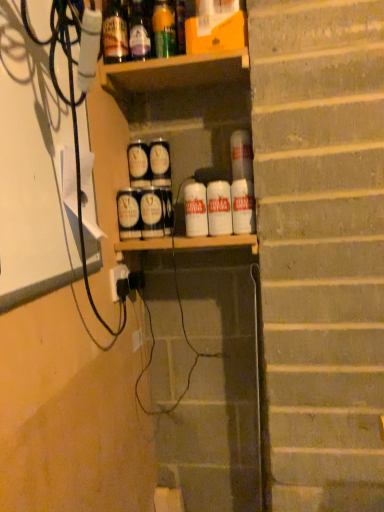
Question: Considering the relative sizes of green glass bottle at upper center, which ranks as the 1th bottle in right-to-left order, and matte black cans at center, which is counted as the 2th spray, starting from the front, in the image provided, is green glass bottle at upper center, which ranks as the 1th bottle in right-to-left order, wider than matte black cans at center, which is counted as the 2th spray, starting from the front,?

Choices:
 (A) yes
 (B) no

Answer: (B)

Question: From the image's perspective, is green glass bottle at upper center, which ranks as the 1th bottle in right-to-left order, below matte black cans at center, the second spray from the back?

Choices:
 (A) yes
 (B) no

Answer: (B)

Question: Is green glass bottle at upper center, which ranks as the 1th bottle in right-to-left order, at the right side of matte black cans at center, the second spray from the back?

Choices:
 (A) yes
 (B) no

Answer: (A)

Question: Does green glass bottle at upper center, which ranks as the 1th bottle in right-to-left order, contain matte black cans at center, which is counted as the 2th spray, starting from the front?

Choices:
 (A) no
 (B) yes

Answer: (A)

Question: Is green glass bottle at upper center, the third bottle positioned from the left, with matte black cans at center, which is counted as the 2th spray, starting from the front?

Choices:
 (A) no
 (B) yes

Answer: (A)

Question: From a real-world perspective, is white matte can at right, which is counted as the first beverage, starting from the right, physically located above or below translucent glass bottle at upper center, arranged as the second bottle when viewed from the right?

Choices:
 (A) above
 (B) below

Answer: (B)

Question: From the image's perspective, is white matte can at right, which is counted as the first beverage, starting from the right, positioned above or below translucent glass bottle at upper center, arranged as the second bottle when viewed from the right?

Choices:
 (A) above
 (B) below

Answer: (B)

Question: Looking at their shapes, would you say white matte can at right, the 5th beverage positioned from the left, is wider or thinner than translucent glass bottle at upper center, the 2th bottle viewed from the left?

Choices:
 (A) wide
 (B) thin

Answer: (B)

Question: Is white matte can at right, which is counted as the first beverage, starting from the right, taller or shorter than translucent glass bottle at upper center, the 2th bottle viewed from the left?

Choices:
 (A) short
 (B) tall

Answer: (A)

Question: Does point pyautogui.click(x=155, y=55) appear closer or farther from the camera than point pyautogui.click(x=157, y=145)?

Choices:
 (A) closer
 (B) farther

Answer: (A)

Question: Choose the correct answer: Is green glass bottle at upper center, which ranks as the 1th bottle in right-to-left order, inside matte black can at center, the 1th beverage in the left-to-right sequence, or outside it?

Choices:
 (A) inside
 (B) outside

Answer: (B)

Question: Considering the relative positions of green glass bottle at upper center, the third bottle positioned from the left, and matte black can at center, the 1th beverage in the left-to-right sequence, in the image provided, is green glass bottle at upper center, the third bottle positioned from the left, to the left or to the right of matte black can at center, the 1th beverage in the left-to-right sequence,?

Choices:
 (A) right
 (B) left

Answer: (A)

Question: From the image's perspective, is green glass bottle at upper center, which ranks as the 1th bottle in right-to-left order, positioned above or below matte black can at center, which appears as the fifth beverage when viewed from the right?

Choices:
 (A) below
 (B) above

Answer: (B)

Question: Considering the positions of point (125, 313) and point (213, 198), is point (125, 313) closer or farther from the camera than point (213, 198)?

Choices:
 (A) closer
 (B) farther

Answer: (B)

Question: Is black plastic cable at left bigger or smaller than white matte can at center, the 3th beverage from the right?

Choices:
 (A) big
 (B) small

Answer: (A)